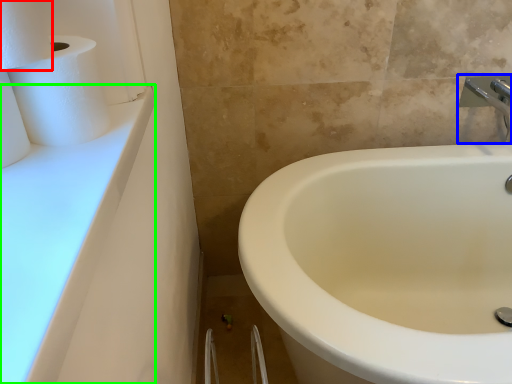
Question: Which object is positioned closest to toilet paper (highlighted by a red box)? Select from tap (highlighted by a blue box) and counter top (highlighted by a green box).

Choices:
 (A) tap
 (B) counter top

Answer: (B)